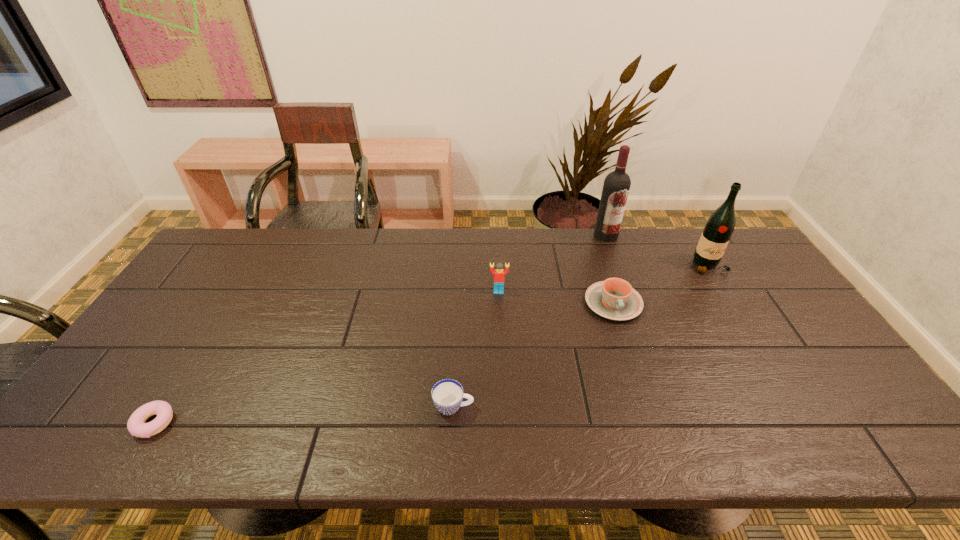
Where is `object present at the near left corner`? object present at the near left corner is located at coordinates (136, 425).

At what (x,y) coordinates should I click in order to perform the action: click on object that is at the far right corner. Please return your answer as a coordinate pair (x, y). Looking at the image, I should click on (720, 225).

Locate an element on the screen. vacant space at the far edge is located at coordinates (x=470, y=258).

Identify the location of free space at the near edge. This screenshot has height=540, width=960. (444, 421).

Where is `vacant space at the left edge of the desktop`? vacant space at the left edge of the desktop is located at coordinates (172, 306).

Identify the location of vacant space at the right edge of the desktop. (808, 372).

Locate an element on the screen. This screenshot has width=960, height=540. vacant area at the far left corner of the desktop is located at coordinates pos(222,252).

The width and height of the screenshot is (960, 540). In order to click on vacant area at the near left corner in this screenshot , I will do `click(108, 437)`.

At what (x,y) coordinates should I click in order to perform the action: click on vacant area between the farther wine bottle and the right wine bottle. Please return your answer as a coordinate pair (x, y). This screenshot has height=540, width=960. Looking at the image, I should click on (658, 251).

Identify the location of free space between the chinaware and the farthest object. The width and height of the screenshot is (960, 540). (610, 269).